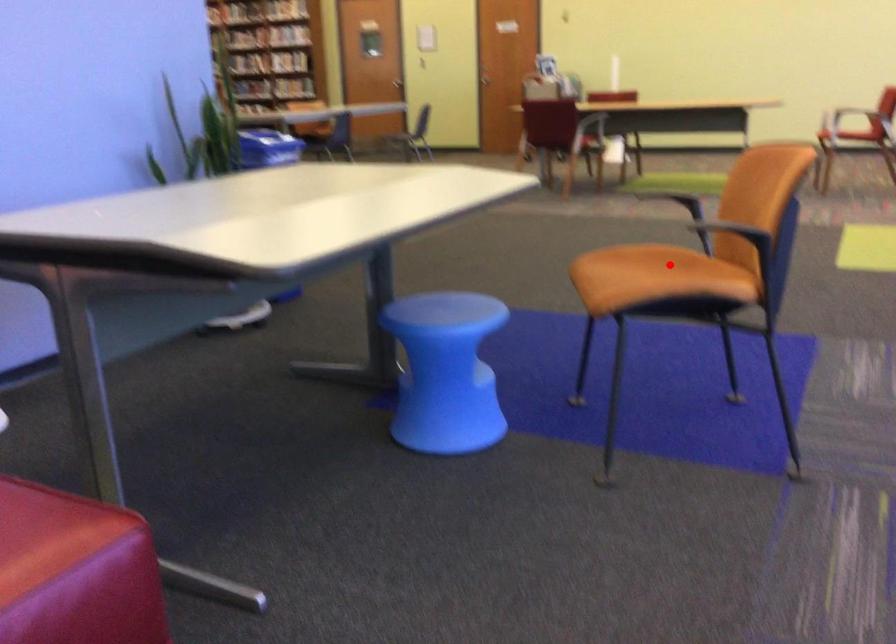
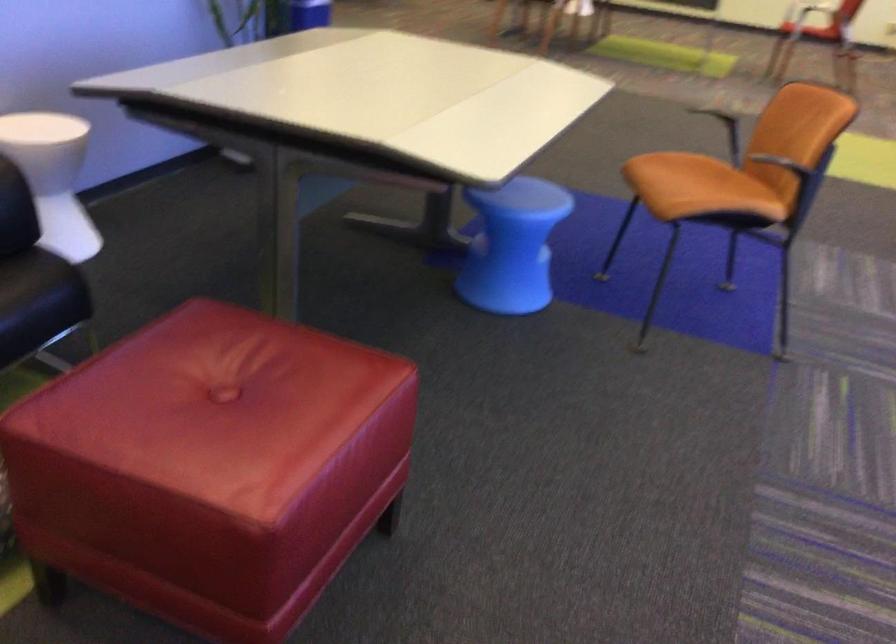
Find the pixel in the second image that matches the highlighted location in the first image.

(711, 173)